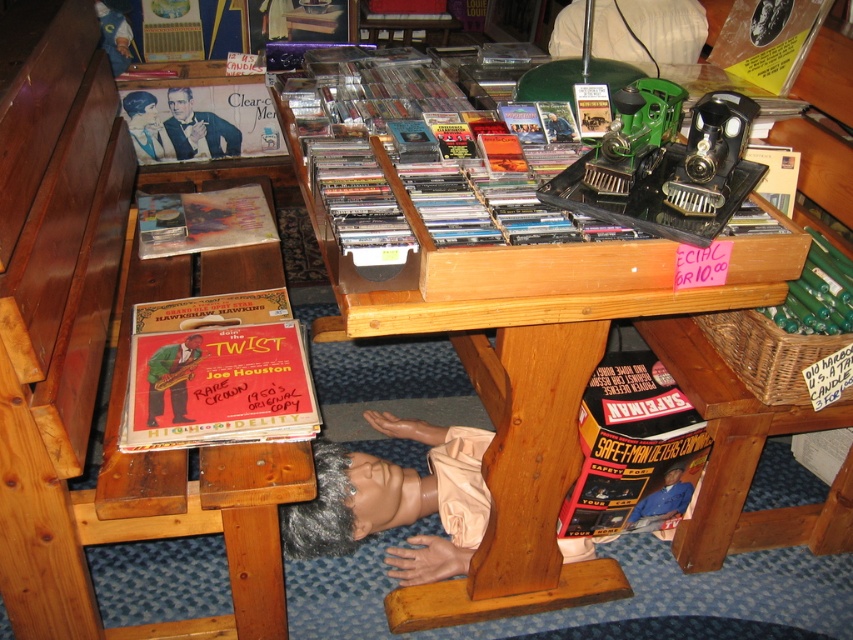
You are a customer who wants to examine the matte plastic record album at upper left but you are currently standing 1.5 meters away from the table. Can you reach it without moving closer?

The matte plastic record album at upper left is 1.72 meters away from the camera, so you are currently 1.5 meters away from the table. Since the distance from you to the album is greater than your current position, you need to move 0.22 meters closer to reach it.

You are a customer at a flea market and see the items on the table. There is a point marked at coordinates (x=202, y=220). What object is located at that point?

The point at coordinates (x=202, y=220) marks the location of the matte plastic record album at upper left.